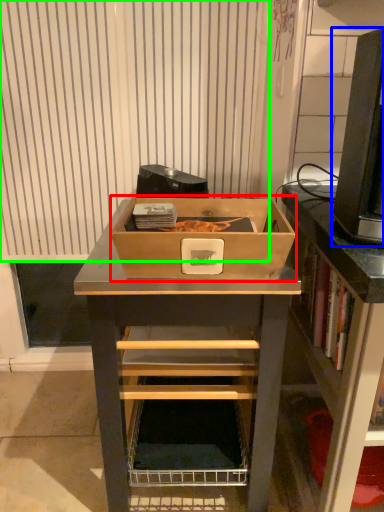
Question: Which object is positioned closest to box (highlighted by a red box)? Select from desktop computer (highlighted by a blue box) and curtain (highlighted by a green box).

Choices:
 (A) desktop computer
 (B) curtain

Answer: (A)